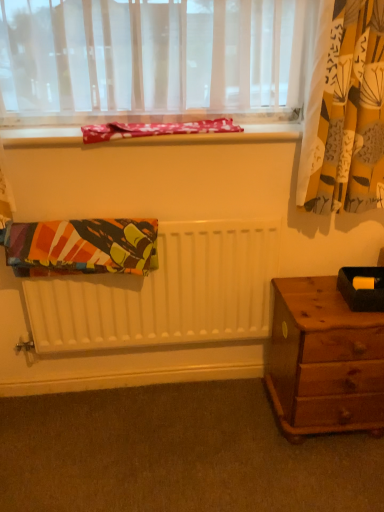
In order to face carpet at lower center, should I rotate leftwards or rightwards?

Rotate left and turn 1.592 degrees.

Describe the element at coordinates (153, 58) in the screenshot. The image size is (384, 512). I see `translucent fabric at upper center` at that location.

Where is `multicolored fabric at center, the 2th blanket positioned from the top`? The image size is (384, 512). multicolored fabric at center, the 2th blanket positioned from the top is located at coordinates (82, 247).

I want to click on carpet at lower center, so click(177, 454).

Is red floral fabric at upper center, the 1th blanket from the top, located outside yellow printed fabric at upper right?

Yes, red floral fabric at upper center, the 1th blanket from the top, is outside of yellow printed fabric at upper right.

From a real-world perspective, is red floral fabric at upper center, which is the 2th blanket in bottom-to-top order, positioned above or below yellow printed fabric at upper right?

Clearly, from a real-world perspective, red floral fabric at upper center, which is the 2th blanket in bottom-to-top order, is below yellow printed fabric at upper right.

Is red floral fabric at upper center, the 1th blanket from the top, in front of yellow printed fabric at upper right?

No, red floral fabric at upper center, the 1th blanket from the top, is behind yellow printed fabric at upper right.

Is point (262, 498) farther from camera compared to point (43, 326)?

No, (262, 498) is in front of (43, 326).

Which of these two, carpet at lower center or white matte radiator at center, is bigger?

With larger size is white matte radiator at center.

From a real-world perspective, between carpet at lower center and white matte radiator at center, who is vertically lower?

In real-world perspective, carpet at lower center is lower.

Considering the sizes of wooden nightstand at lower right and white matte radiator at center in the image, is wooden nightstand at lower right taller or shorter than white matte radiator at center?

Considering their sizes, wooden nightstand at lower right has less height than white matte radiator at center.

In the scene shown: From a real-world perspective, who is located lower, wooden nightstand at lower right or white matte radiator at center?

wooden nightstand at lower right is physically lower.

Find the location of a particular element. radiator that is behind the wooden nightstand at lower right is located at coordinates (166, 293).

How much distance is there between wooden nightstand at lower right and white matte radiator at center?

wooden nightstand at lower right and white matte radiator at center are 14.39 inches apart.

Does wooden nightstand at lower right have a lesser height compared to multicolored fabric at center, the 2th blanket positioned from the top?

Incorrect, the height of wooden nightstand at lower right does not fall short of that of multicolored fabric at center, the 2th blanket positioned from the top.

Is wooden nightstand at lower right in contact with multicolored fabric at center, acting as the first blanket starting from the bottom?

No, wooden nightstand at lower right is not next to multicolored fabric at center, acting as the first blanket starting from the bottom.

From a real-world perspective, who is located higher, wooden nightstand at lower right or multicolored fabric at center, acting as the first blanket starting from the bottom?

multicolored fabric at center, acting as the first blanket starting from the bottom, from a real-world perspective.

How different are the orientations of white matte radiator at center and wooden nightstand at lower right in degrees?

The angle between the facing direction of white matte radiator at center and the facing direction of wooden nightstand at lower right is 0.708 degrees.

Locate an element on the screen. The image size is (384, 512). nightstand in front of the white matte radiator at center is located at coordinates [x=324, y=361].

Considering the relative sizes of white matte radiator at center and wooden nightstand at lower right in the image provided, is white matte radiator at center shorter than wooden nightstand at lower right?

Incorrect, the height of white matte radiator at center does not fall short of that of wooden nightstand at lower right.

Is point (160, 295) positioned in front of point (349, 375)?

No, it is not.

Does point (11, 25) come farther from viewer compared to point (185, 459)?

No, (11, 25) is in front of (185, 459).

Is translucent fabric at upper center turned away from carpet at lower center?

translucent fabric at upper center is not turned away from carpet at lower center.

From the image's perspective, would you say carpet at lower center is shown under multicolored fabric at center, acting as the first blanket starting from the bottom?

Yes.

Which is less distant, (x=103, y=471) or (x=13, y=266)?

The point (x=13, y=266) is in front.

Can you confirm if carpet at lower center is taller than multicolored fabric at center, acting as the first blanket starting from the bottom?

No, carpet at lower center is not taller than multicolored fabric at center, acting as the first blanket starting from the bottom.

Based on their sizes in the image, would you say carpet at lower center is bigger or smaller than multicolored fabric at center, the 2th blanket positioned from the top?

Considering their sizes, carpet at lower center takes up more space than multicolored fabric at center, the 2th blanket positioned from the top.

Locate an element on the screen. This screenshot has height=512, width=384. the 2nd blanket behind the yellow printed fabric at upper right, starting your count from the anchor is located at coordinates [156, 129].

This screenshot has height=512, width=384. Find the location of `plain lying below the white matte radiator at center (from the image's perspective)`. plain lying below the white matte radiator at center (from the image's perspective) is located at coordinates (177, 454).

Estimate the real-world distances between objects in this image. Which object is further from carpet at lower center, translucent fabric at upper center or black matte box at right?

Based on the image, translucent fabric at upper center appears to be further to carpet at lower center.

When comparing their distances from translucent fabric at upper center, does white matte radiator at center or black matte box at right seem closer?

white matte radiator at center is positioned closer to the anchor translucent fabric at upper center.

Considering their positions, is carpet at lower center positioned further to multicolored fabric at center, the 2th blanket positioned from the top, than red floral fabric at upper center, the 1th blanket from the top?

Based on the image, carpet at lower center appears to be further to multicolored fabric at center, the 2th blanket positioned from the top.

Based on their spatial positions, is white matte radiator at center or wooden nightstand at lower right further from carpet at lower center?

white matte radiator at center is further to carpet at lower center.

Based on their spatial positions, is carpet at lower center or white matte radiator at center further from yellow printed fabric at upper right?

The object further to yellow printed fabric at upper right is carpet at lower center.

Which object lies nearer to the anchor point yellow printed fabric at upper right, white matte radiator at center or multicolored fabric at center, acting as the first blanket starting from the bottom?

white matte radiator at center lies closer to yellow printed fabric at upper right than the other object.

When comparing their distances from matte fabric at upper center, does multicolored fabric at center, acting as the first blanket starting from the bottom, or wooden nightstand at lower right seem further?

wooden nightstand at lower right is further to matte fabric at upper center.

Based on the photo, estimate the real-world distances between objects in this image. Which object is further from red floral fabric at upper center, the 1th blanket from the top, translucent fabric at upper center or carpet at lower center?

The object further to red floral fabric at upper center, the 1th blanket from the top, is carpet at lower center.

Locate an element on the screen. Image resolution: width=384 pixels, height=512 pixels. blanket between translucent fabric at upper center and multicolored fabric at center, acting as the first blanket starting from the bottom, vertically is located at coordinates click(x=156, y=129).

The image size is (384, 512). Find the location of `blanket between red floral fabric at upper center, the 1th blanket from the top, and carpet at lower center vertically`. blanket between red floral fabric at upper center, the 1th blanket from the top, and carpet at lower center vertically is located at coordinates (82, 247).

At what (x,y) coordinates should I click in order to perform the action: click on window sill that lies between translucent fabric at upper center and white matte radiator at center from top to bottom. Please return your answer as a coordinate pair (x, y). The width and height of the screenshot is (384, 512). Looking at the image, I should click on (232, 134).

Where is `window sill between translucent fabric at upper center and wooden nightstand at lower right in the up-down direction`? The width and height of the screenshot is (384, 512). window sill between translucent fabric at upper center and wooden nightstand at lower right in the up-down direction is located at coordinates (232, 134).